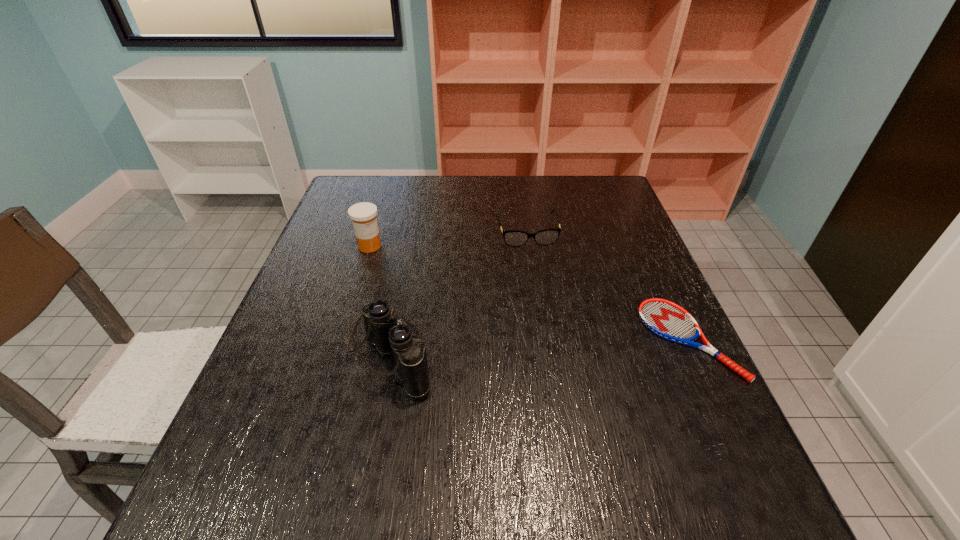
Where is `blank area located 0.280m on the label of the third shortest object`? The height and width of the screenshot is (540, 960). blank area located 0.280m on the label of the third shortest object is located at coordinates 463,289.

Identify the location of free space located on the front-facing side of the spectacles. (557, 345).

Locate an element on the screen. free location located 0.330m on the front-facing side of the spectacles is located at coordinates (555, 338).

Find the location of a particular element. Image resolution: width=960 pixels, height=540 pixels. free spot located on the front-facing side of the spectacles is located at coordinates (537, 271).

Where is `binoculars that is at the left edge`? This screenshot has height=540, width=960. binoculars that is at the left edge is located at coordinates (384, 331).

Identify the location of medicine at the left edge. This screenshot has height=540, width=960. (363, 215).

Locate an element on the screen. Image resolution: width=960 pixels, height=540 pixels. object that is at the right edge is located at coordinates (668, 320).

Find the location of a particular element. This screenshot has height=540, width=960. free space at the far edge is located at coordinates (479, 195).

In the image, there is a desktop. Where is `vacant region at the left edge`? The width and height of the screenshot is (960, 540). vacant region at the left edge is located at coordinates (352, 238).

Locate an element on the screen. free space at the right edge of the desktop is located at coordinates (645, 394).